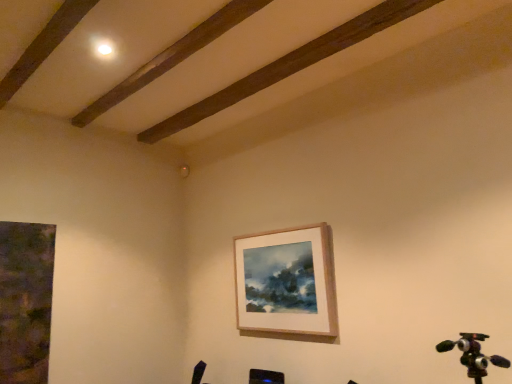
Image resolution: width=512 pixels, height=384 pixels. Describe the element at coordinates (287, 282) in the screenshot. I see `wooden frame at upper center` at that location.

You are a GUI agent. You are given a task and a screenshot of the screen. Output one action in this format:
    pyautogui.click(x=<x>, y=<y>)
    Task: Click on the wooden frame at upper center
    The width and height of the screenshot is (512, 384).
    Given the screenshot: What is the action you would take?
    pyautogui.click(x=287, y=282)

I want to click on wooden frame at upper center, so click(x=287, y=282).